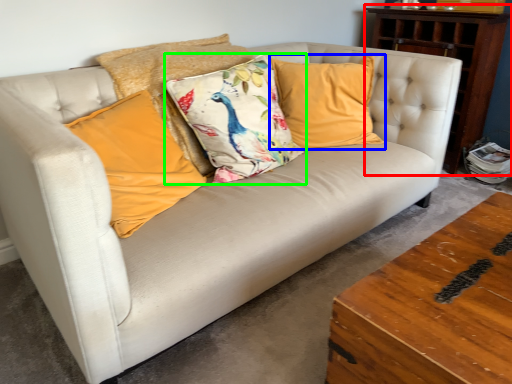
Question: Which is farther away from dresser (highlighted by a red box)? pillow (highlighted by a blue box) or pillow (highlighted by a green box)?

Choices:
 (A) pillow
 (B) pillow

Answer: (B)